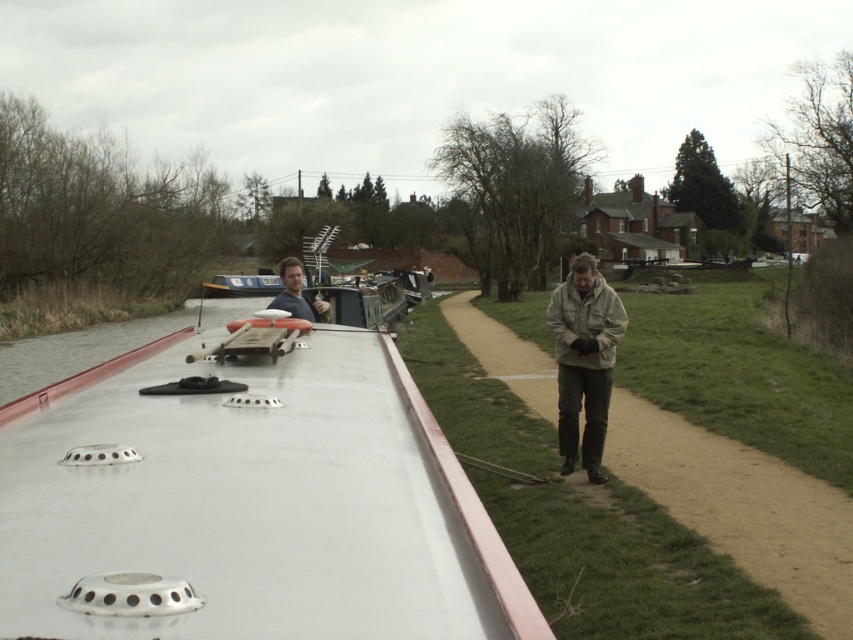
Question: Which point is closer to the camera?

Choices:
 (A) (136, 476)
 (B) (577, 305)
 (C) (229, 296)
 (D) (293, 257)

Answer: (A)

Question: Which of the following is the closest to the observer?

Choices:
 (A) white glossy boat at left
 (B) matte gray shirt at center
 (C) beige textured jacket at center

Answer: (A)

Question: Can you confirm if white glossy boat at left is positioned to the left of matte gray shirt at center?

Choices:
 (A) no
 (B) yes

Answer: (A)

Question: Can you confirm if white glossy boat at left is positioned to the left of tan fabric jacket at right?

Choices:
 (A) yes
 (B) no

Answer: (A)

Question: Does white glossy boat at left appear over tan fabric jacket at right?

Choices:
 (A) yes
 (B) no

Answer: (A)

Question: Which of the following is the farthest from the observer?

Choices:
 (A) tan fabric jacket at right
 (B) blue glossy boat at center
 (C) matte gray shirt at center

Answer: (B)